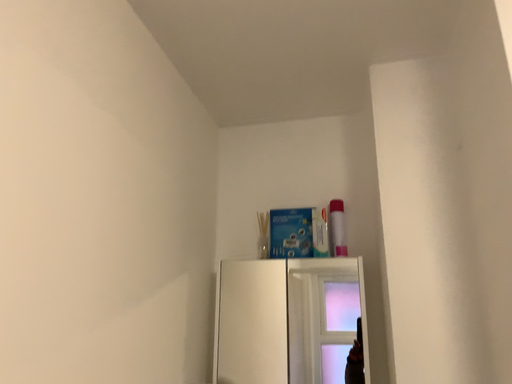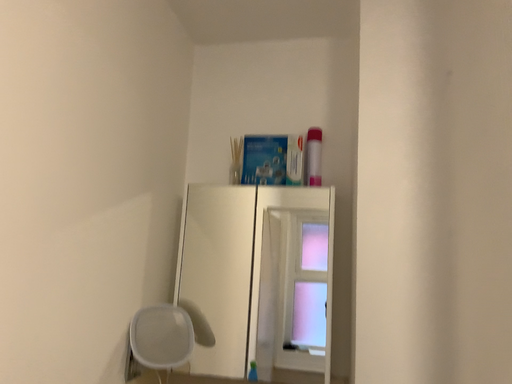
Question: How did the camera likely rotate when shooting the video?

Choices:
 (A) rotated upward
 (B) rotated downward

Answer: (B)